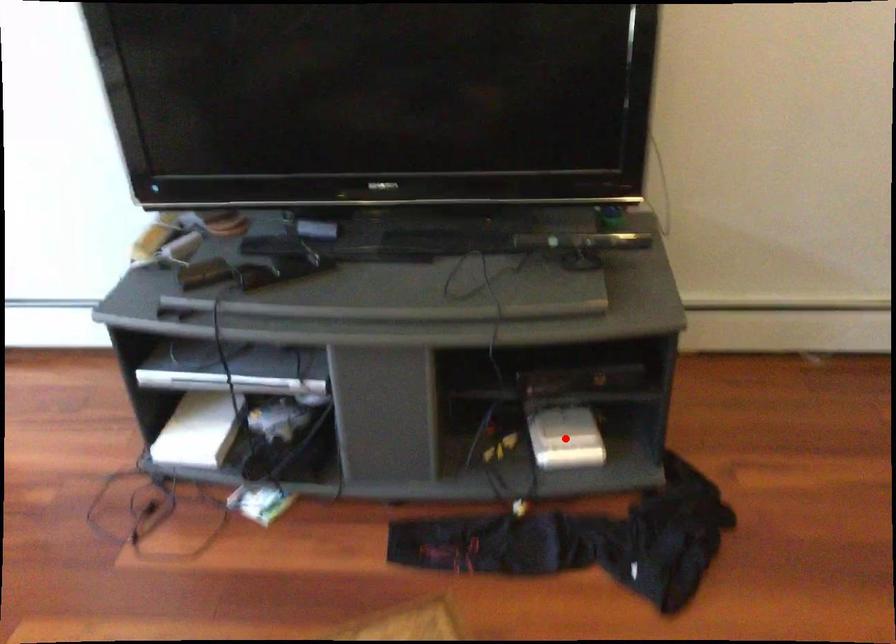
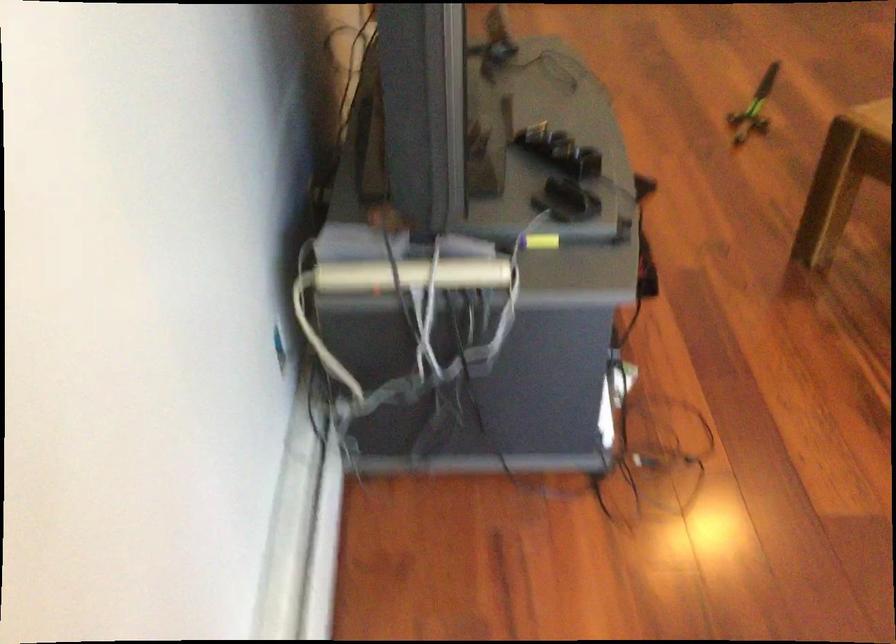
Question: I am providing you with two images of the same scene from different viewpoints. A red point is marked on the first image. Is the red point's position out of view in image 2?

Choices:
 (A) Yes
 (B) No

Answer: (A)